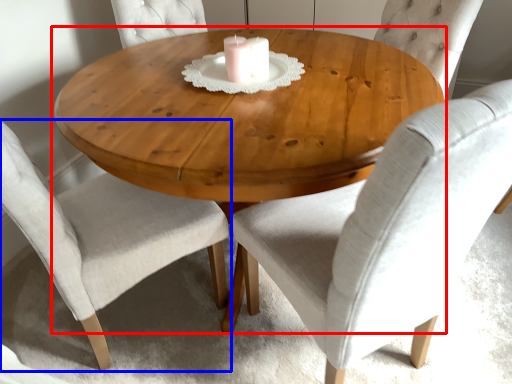
Question: Which object appears closest to the camera in this image, coffee table (highlighted by a red box) or chair (highlighted by a blue box)?

Choices:
 (A) coffee table
 (B) chair

Answer: (B)